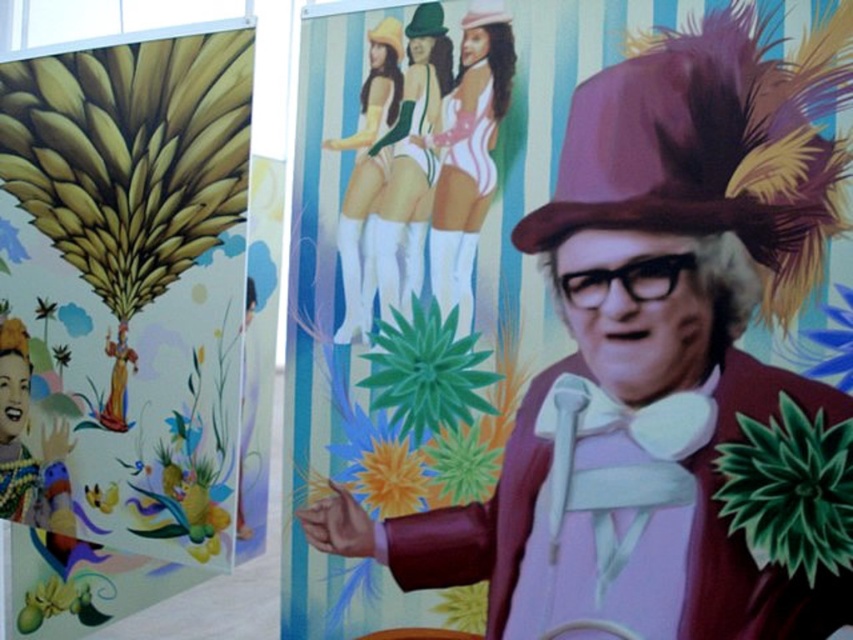
Question: Which point appears farthest from the camera in this image?

Choices:
 (A) (583, 124)
 (B) (469, 173)

Answer: (B)

Question: Can you confirm if gold leaf mural at left is positioned above matte pink swimsuit at center?

Choices:
 (A) no
 (B) yes

Answer: (A)

Question: Does matte pink swimsuit at center appear on the left side of smooth green dress at center?

Choices:
 (A) yes
 (B) no

Answer: (B)

Question: Can you confirm if matte burgundy coat at center is bigger than green fabric dress at center?

Choices:
 (A) yes
 (B) no

Answer: (A)

Question: Which point is closer to the camera taking this photo?

Choices:
 (A) (637, 288)
 (B) (408, 182)
 (C) (374, 36)
 (D) (471, 216)

Answer: (A)

Question: Which is farther from the gold leaf mural at left?

Choices:
 (A) matte burgundy coat at center
 (B) matte pink swimsuit at center
 (C) green fabric dress at center

Answer: (A)